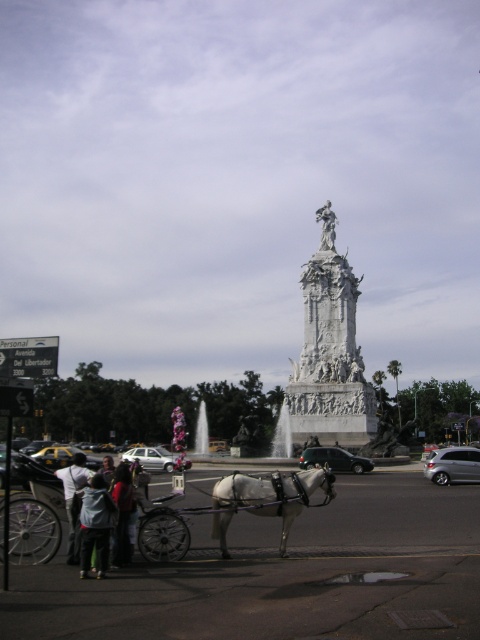
You are a tour guide explaining the vehicles in the scene. Which vehicle is taller between the satin silver sedan at lower right and the silver metallic car at lower left?

The satin silver sedan at lower right is taller than the silver metallic car at lower left according to the description provided.

You are a photographer trying to capture a photo of both the white leather horse at center and the silver metallic car at lower left. Based on their positions, which object should you focus on first to ensure both are in the frame?

The white leather horse at center is located below the silver metallic car at lower left, so you should focus on the silver metallic car at lower left first to ensure both are in the frame.